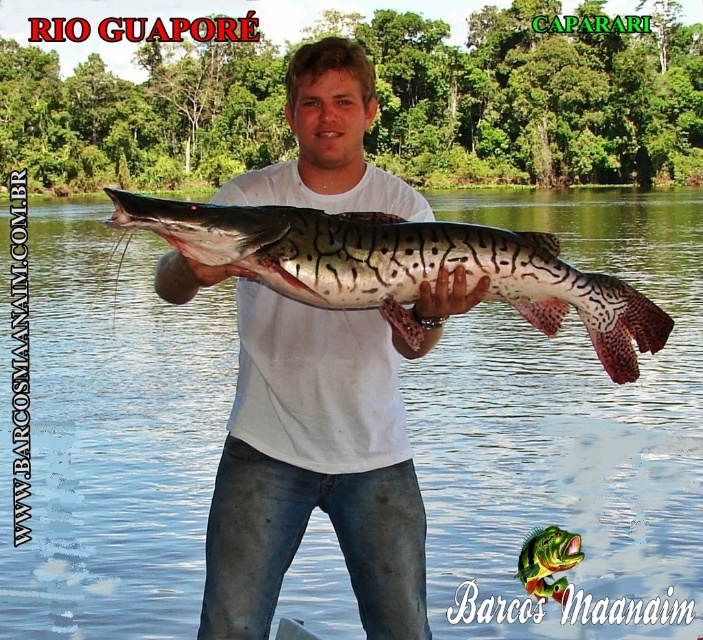
Based on the scene, if you were to look at the clear water at center and the speckled skin catfish at center, which one is positioned to the right?

The speckled skin catfish at center is positioned to the right of the clear water at center.

Based on the scene, if you were to look down from the person holding the speckled skin catfish at center, what would you see below the clear water at center?

The speckled skin catfish at center is below the clear water at center.